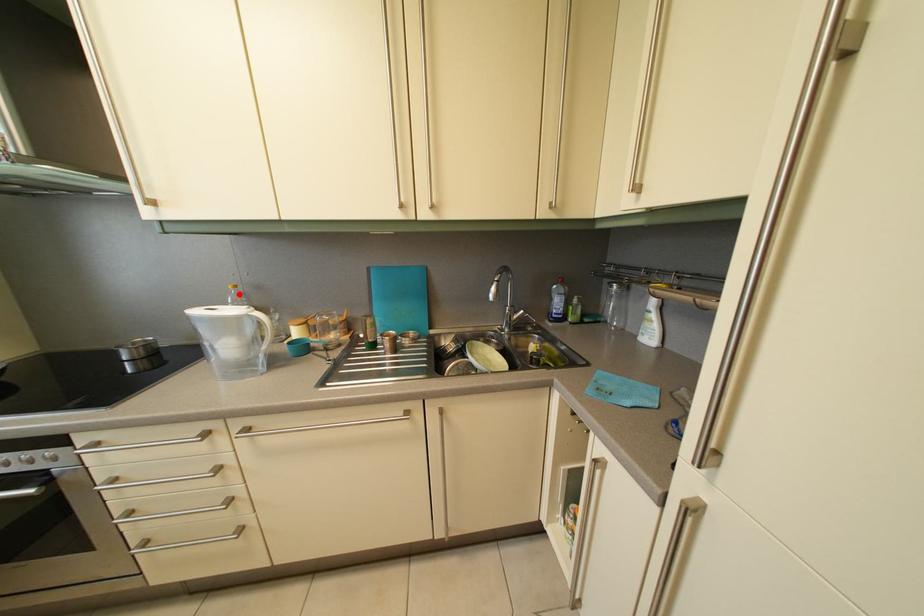
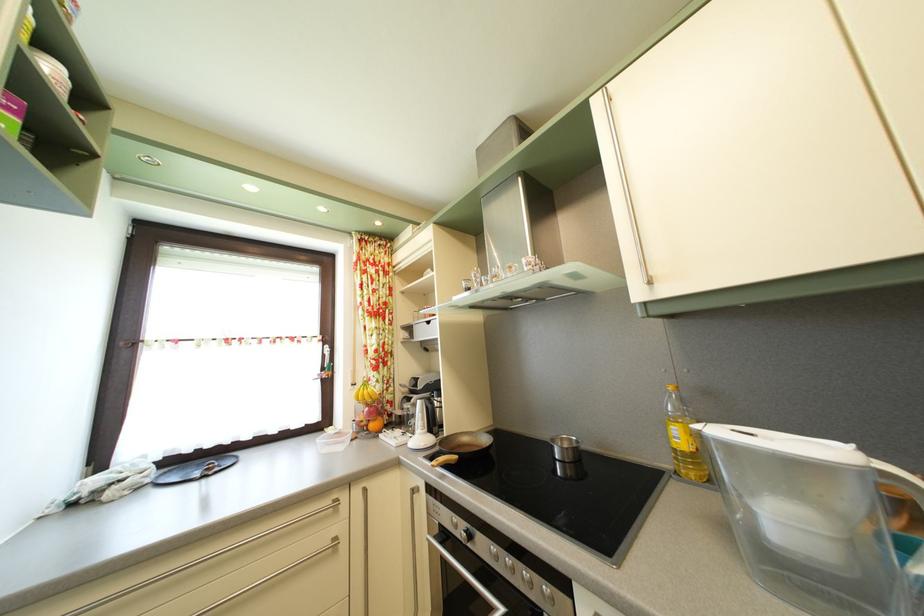
In the second image, find the point that corresponds to the highlighted location in the first image.

(678, 395)